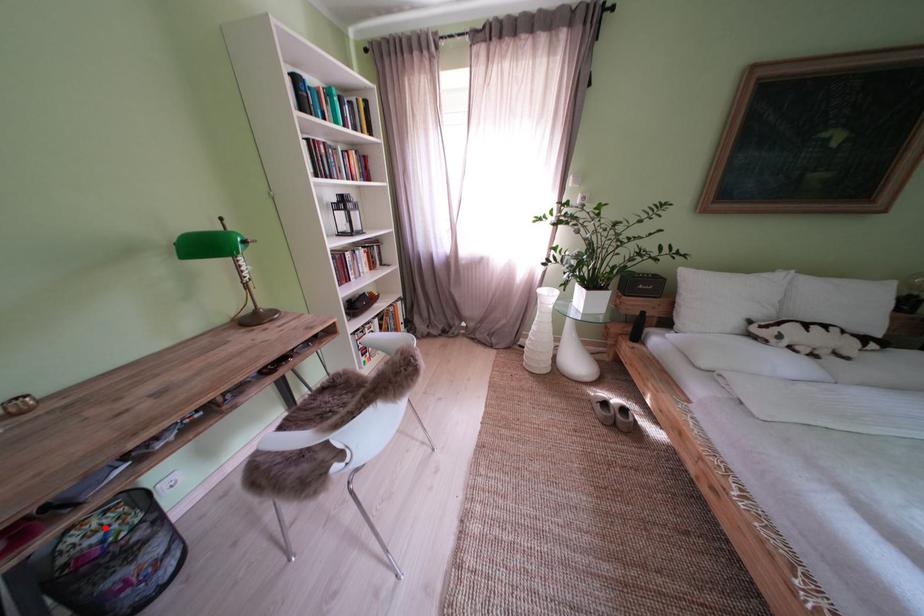
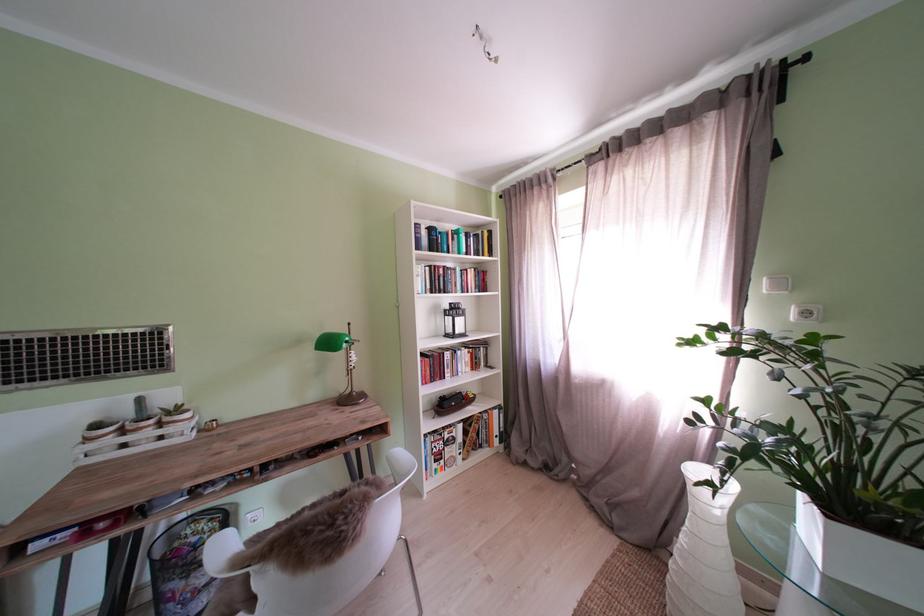
The point at the highlighted location is marked in the first image. Where is the corresponding point in the second image?

(213, 530)